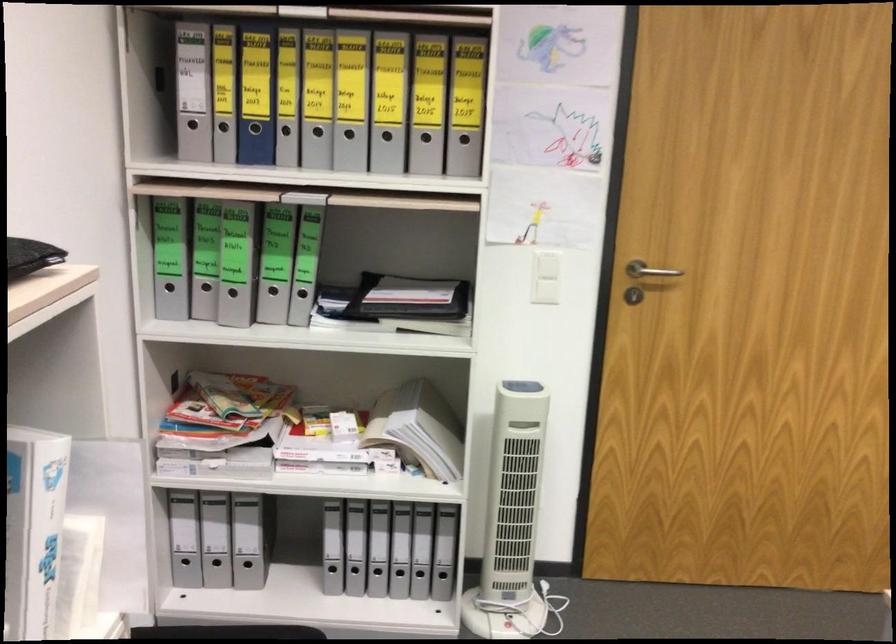
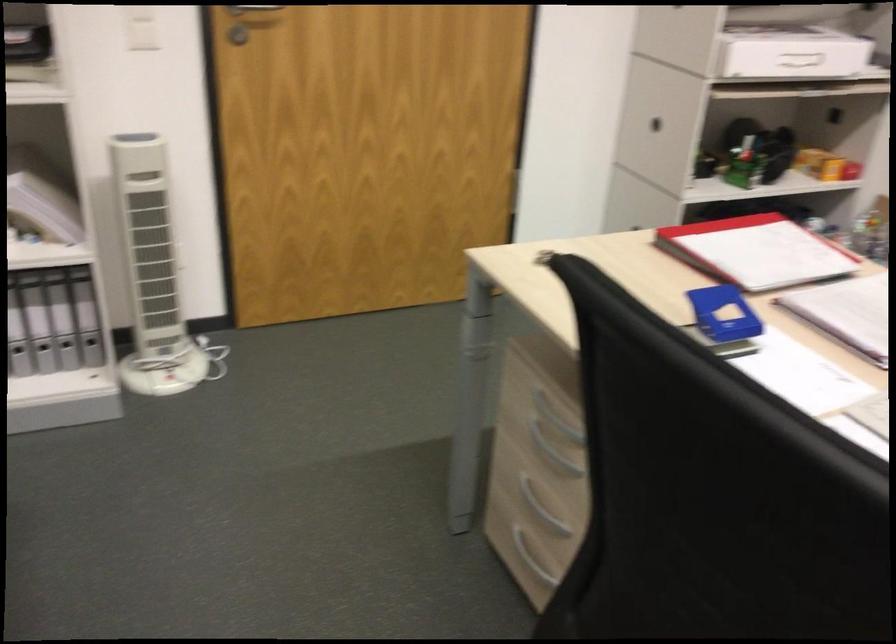
Question: I am providing you with two images of the same scene from different viewpoints. Which of the following objects are not visible in image2?

Choices:
 (A) white tower fan
 (B) silver drawer handle
 (C) silver door handle
 (D) none of these

Answer: (D)